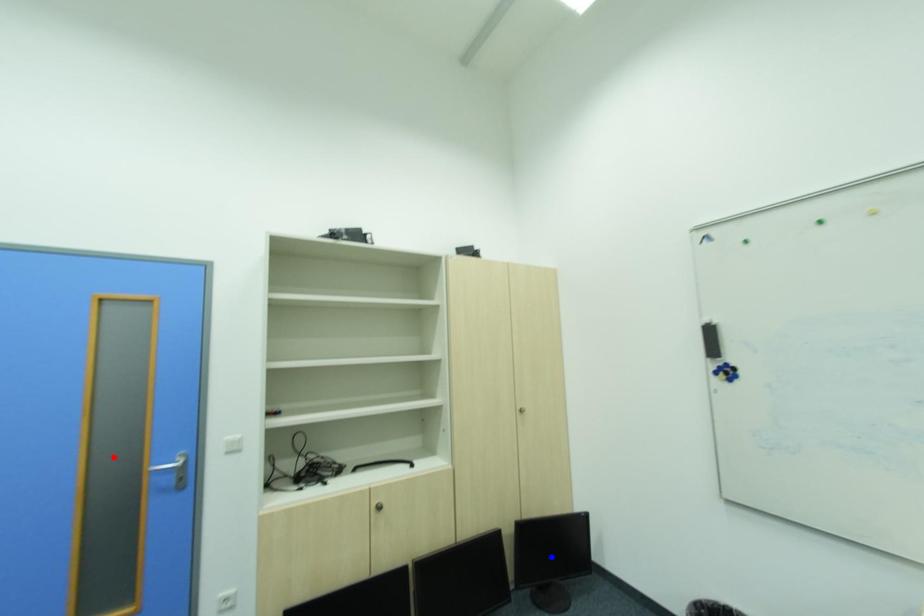
Question: Two points are marked on the image. Which point is closer to the camera?

Choices:
 (A) Blue point is closer.
 (B) Red point is closer.

Answer: (B)